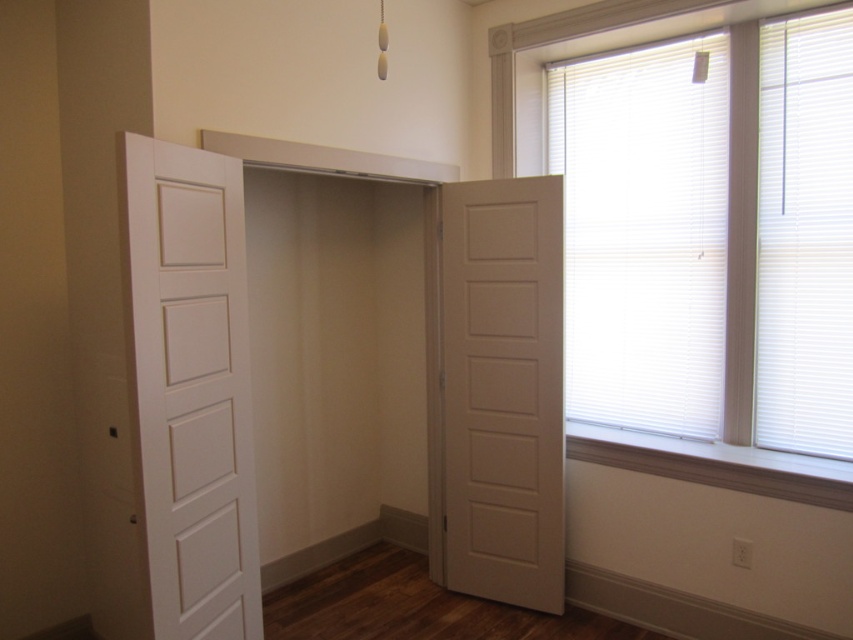
Question: Observing the image, what is the correct spatial positioning of white matte door at left in reference to white blinds at upper right?

Choices:
 (A) above
 (B) below

Answer: (B)

Question: Is white matte door at right to the right of white blinds at upper right from the viewer's perspective?

Choices:
 (A) yes
 (B) no

Answer: (B)

Question: Can you confirm if white matte door at left is thinner than white matte door at right?

Choices:
 (A) no
 (B) yes

Answer: (B)

Question: Which point is closer to the camera taking this photo?

Choices:
 (A) (148, 323)
 (B) (492, 282)
 (C) (757, 460)

Answer: (A)

Question: Which of the following is the farthest from the observer?

Choices:
 (A) (752, 417)
 (B) (234, 502)

Answer: (A)

Question: Which of the following is the closest to the observer?

Choices:
 (A) white matte door at right
 (B) white blinds at upper right

Answer: (B)